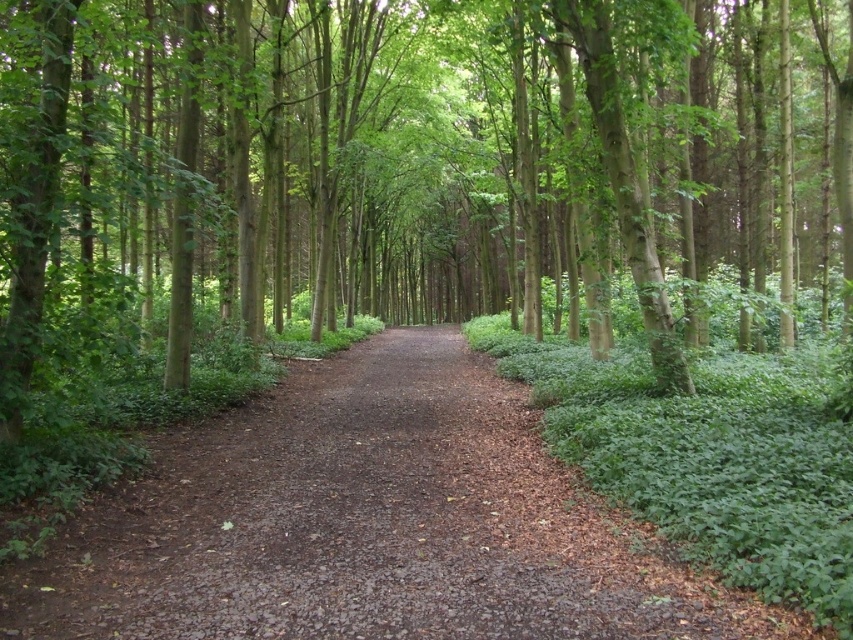
You are a hiker carrying a backpack and want to take a photo of the green matte tree at center from a distance of 7 meters. Can you position yourself to take the photo without moving closer than 7 meters?

The green matte tree at center is 7.24 meters from camera, so yes, you can position yourself at exactly 7.24 meters to take the photo without moving closer than 7 meters.

You are a hiker carrying a heavy backpack and want to rest on the brown dirt path at center. However, there is a green matte tree at center blocking your way. Can you walk around it to reach the path?

The green matte tree at center is located above brown dirt path at center, so the tree is directly over the path. This means you cannot walk around it to reach the path as the tree is blocking the entire path.

You are a hiker trying to navigate through the forest. You see the green matte tree at center and the brown dirt path at center. Which one is taller?

The green matte tree at center is much taller than the brown dirt path at center.